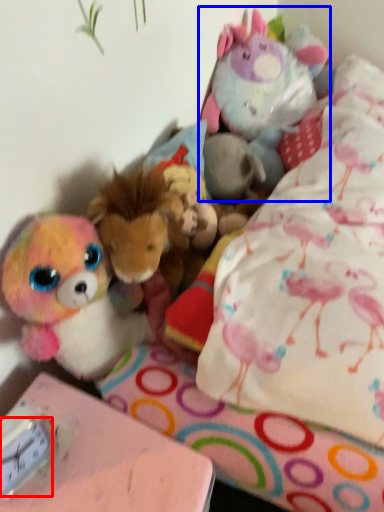
Question: Which object appears closest to the camera in this image, clock (highlighted by a red box) or toy (highlighted by a blue box)?

Choices:
 (A) clock
 (B) toy

Answer: (A)